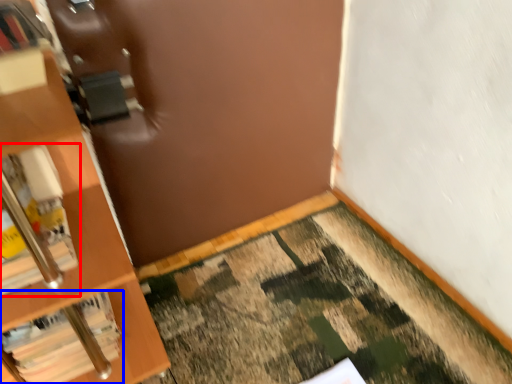
Question: Which object is closer to the camera taking this photo, book (highlighted by a red box) or book (highlighted by a blue box)?

Choices:
 (A) book
 (B) book

Answer: (A)